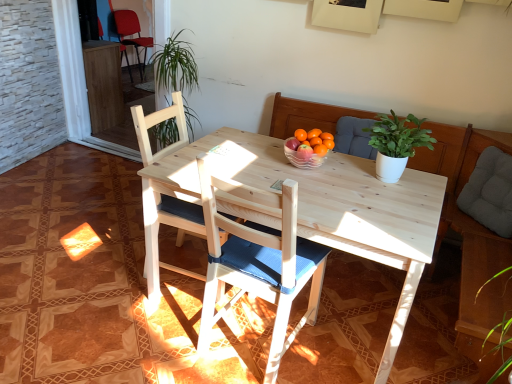
Question: From a real-world perspective, relative to wooden chair at center, the 2th chair in the top-to-bottom sequence, is gray fabric cushion at right vertically above or below?

Choices:
 (A) below
 (B) above

Answer: (B)

Question: Considering the positions of gray fabric cushion at right and wooden chair at center, marked as the second chair in a back-to-front arrangement, in the image, is gray fabric cushion at right taller or shorter than wooden chair at center, marked as the second chair in a back-to-front arrangement,?

Choices:
 (A) tall
 (B) short

Answer: (B)

Question: Based on their relative distances, which object is farther from the wooden chair at center, which appears as the 2th chair when ordered from the bottom?

Choices:
 (A) matte red chair at upper left, the third chair in the front-to-back sequence
 (B) gray fabric cushion at right
 (C) white matte plant at upper center
 (D) clear glass bowl at center
 (E) wooden chair with blue cushion at center, which is counted as the third chair, starting from the back

Answer: (A)

Question: Estimate the real-world distances between objects in this image. Which object is farther from the white matte plant at upper center?

Choices:
 (A) matte red chair at upper left, the 3th chair ordered from the bottom
 (B) clear glass bowl at center
 (C) wooden chair with blue cushion at center, arranged as the first chair when ordered from the bottom
 (D) wooden chair at center, marked as the second chair in a back-to-front arrangement
 (E) gray fabric cushion at right

Answer: (A)